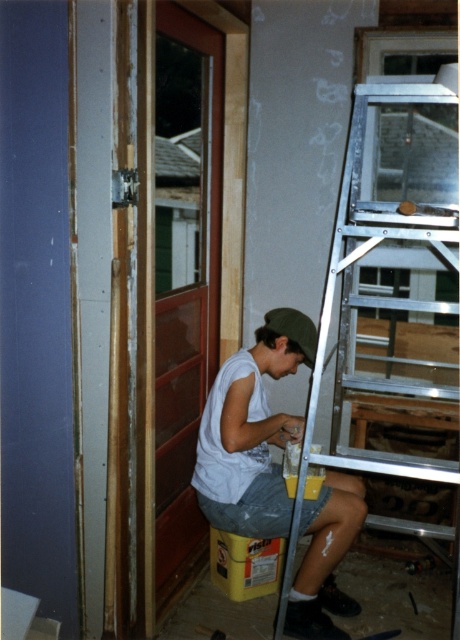
You are a safety inspector checking the construction site. You notice the silver metallic ladder at right and the white matte shirt at center. Which object is wider in terms of physical dimensions?

The silver metallic ladder at right is wider than the white matte shirt at center, as its width surpasses that of the shirt.

You are a delivery person who needs to place a box that is 1.5 meters long on the floor between the silver metallic ladder at right and the camera. Is there enough space?

The distance between the silver metallic ladder at right and the camera is 1.87 meters. Since the box is 1.5 meters long, there is sufficient space to place it between them.

You are a safety inspector visiting the construction site shown in the image. You notice the silver metallic ladder at right and the white matte shirt at center. According to safety protocols, which object should be moved to ensure the worker is not in a hazardous position?

The silver metallic ladder at right should be moved away from the white matte shirt at center to ensure the worker is not in a hazardous position, as the ladder is currently positioned over the shirt.